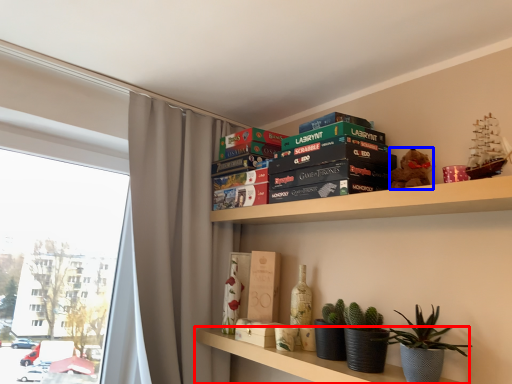
Question: Among these objects, which one is farthest to the camera, shelf (highlighted by a red box) or toy (highlighted by a blue box)?

Choices:
 (A) shelf
 (B) toy

Answer: (B)